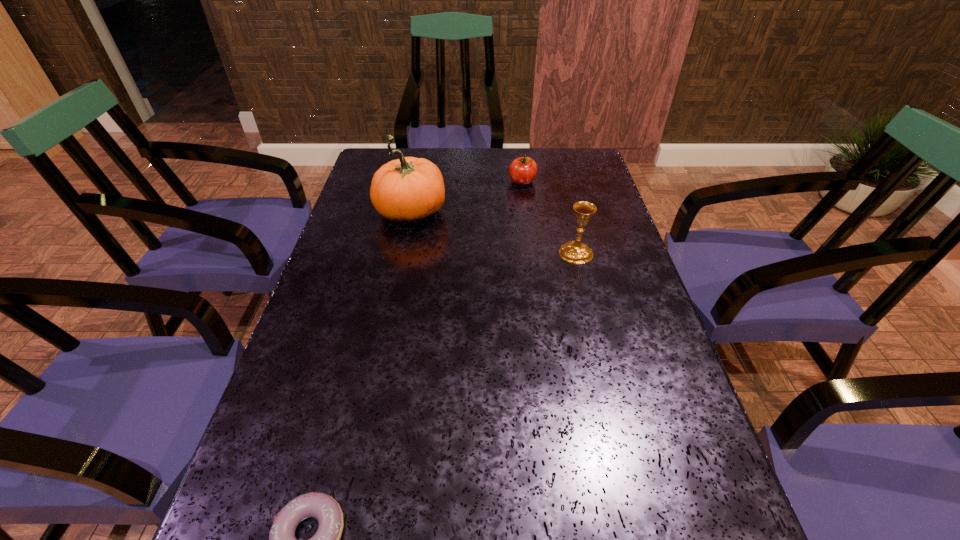
Locate an element on the screen. This screenshot has width=960, height=540. free space between the tallest object and the third farthest object is located at coordinates (493, 233).

You are a GUI agent. You are given a task and a screenshot of the screen. Output one action in this format:
    pyautogui.click(x=<x>, y=<y>)
    Task: Click on the unoccupied area between the third tallest object and the pumpkin
    This screenshot has height=540, width=960.
    Given the screenshot: What is the action you would take?
    pyautogui.click(x=467, y=198)

This screenshot has width=960, height=540. I want to click on object that stands as the third closest to the rightmost object, so click(324, 508).

Identify which object is the third closest to the second farthest object. Please provide its 2D coordinates. Your answer should be formatted as a tuple, i.e. [(x, y)], where the tuple contains the x and y coordinates of a point satisfying the conditions above.

[(324, 508)]

Where is `blank space that satisfies the following two spatial constraints: 1. on the back side of the third object from left to right; 2. on the right side of the pumpkin`? blank space that satisfies the following two spatial constraints: 1. on the back side of the third object from left to right; 2. on the right side of the pumpkin is located at coordinates (417, 182).